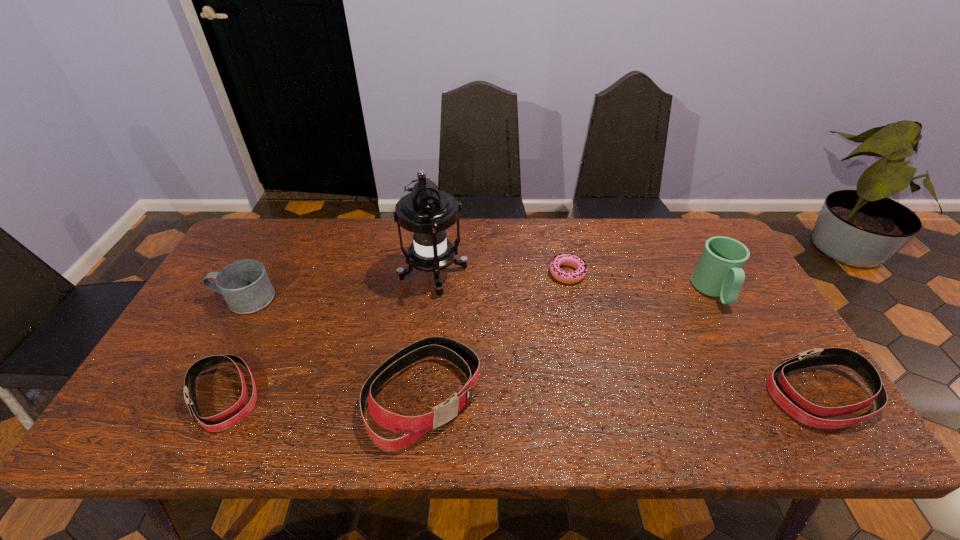
What are the coordinates of `vacant spot for a new dog_collar to ensure equal spacing` in the screenshot? It's located at (622, 395).